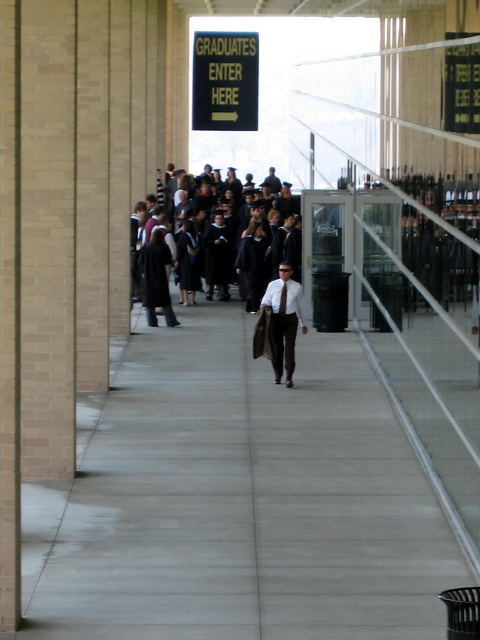
Question: Among these objects, which one is nearest to the camera?

Choices:
 (A) brown leather pants at center
 (B) black matte graduation gowns at center
 (C) gold/black sign at upper center

Answer: (A)

Question: In this image, where is brown leather pants at center located relative to black matte graduation gowns at center?

Choices:
 (A) above
 (B) below

Answer: (B)

Question: Does gold/black sign at upper center have a larger size compared to black matte graduation gowns at center?

Choices:
 (A) no
 (B) yes

Answer: (B)

Question: Among these objects, which one is farthest from the camera?

Choices:
 (A) gold/black sign at upper center
 (B) black matte graduation gowns at center
 (C) brown leather pants at center

Answer: (A)

Question: Is brown leather pants at center smaller than black matte graduation gowns at center?

Choices:
 (A) no
 (B) yes

Answer: (A)

Question: Which of these objects is positioned closest to the brown leather pants at center?

Choices:
 (A) gold/black sign at upper center
 (B) black matte graduation gowns at center

Answer: (B)